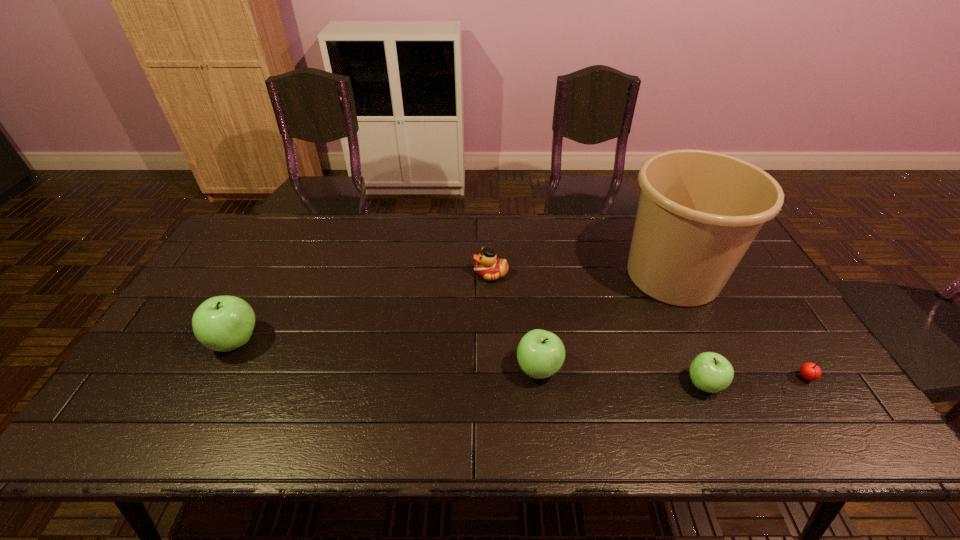
Where is `the tallest apple`? the tallest apple is located at coordinates (223, 323).

Where is `the fifth shortest object`? Image resolution: width=960 pixels, height=540 pixels. the fifth shortest object is located at coordinates (223, 323).

I want to click on the second apple from right to left, so click(x=540, y=353).

At what (x,y) coordinates should I click in order to perform the action: click on the third object from left to right. Please return your answer as a coordinate pair (x, y). Looking at the image, I should click on (540, 353).

The width and height of the screenshot is (960, 540). What are the coordinates of `the shortest apple` in the screenshot? It's located at (710, 372).

Locate an element on the screen. The width and height of the screenshot is (960, 540). bucket is located at coordinates (699, 211).

Locate an element on the screen. The width and height of the screenshot is (960, 540). the second object from left to right is located at coordinates (488, 266).

This screenshot has width=960, height=540. I want to click on cherry, so click(810, 371).

This screenshot has width=960, height=540. I want to click on blank space located 0.070m on the right of the leftmost object, so click(288, 341).

Find the location of a particular element. The height and width of the screenshot is (540, 960). free space located 0.150m on the left of the second tallest apple is located at coordinates (456, 369).